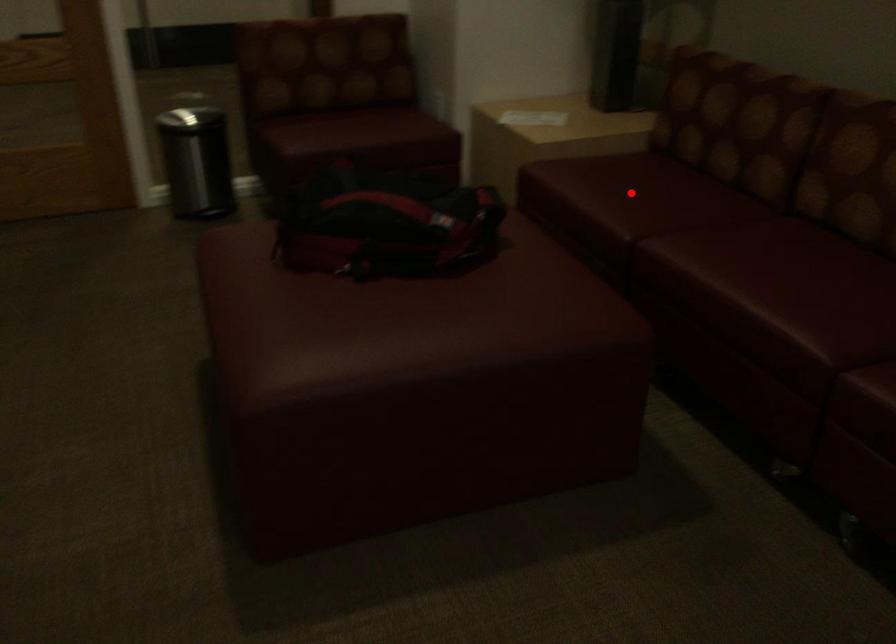
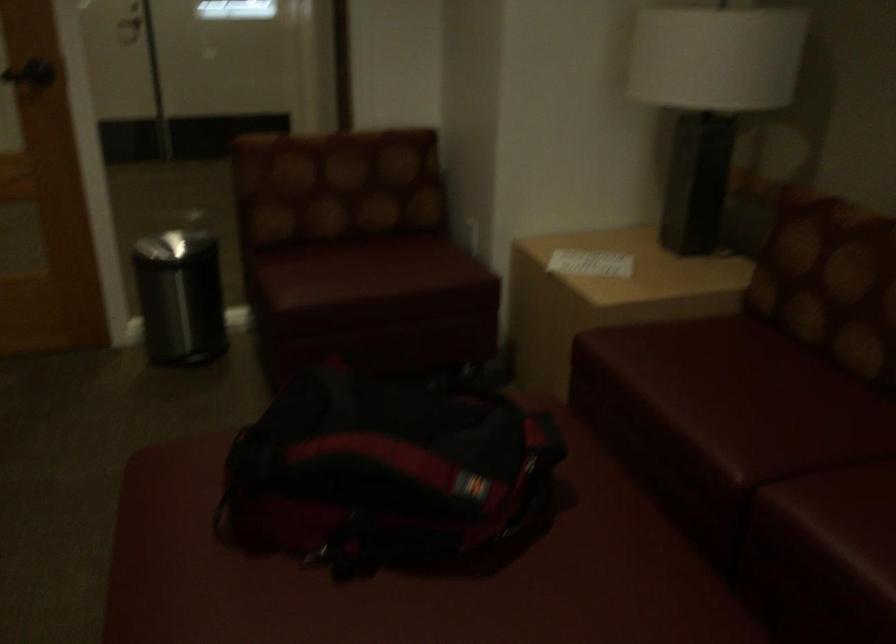
Question: I am providing you with two images of the same scene from different viewpoints. A red point is marked on the first image. Can you still see the location of the red point in image 2?

Choices:
 (A) Yes
 (B) No

Answer: (A)